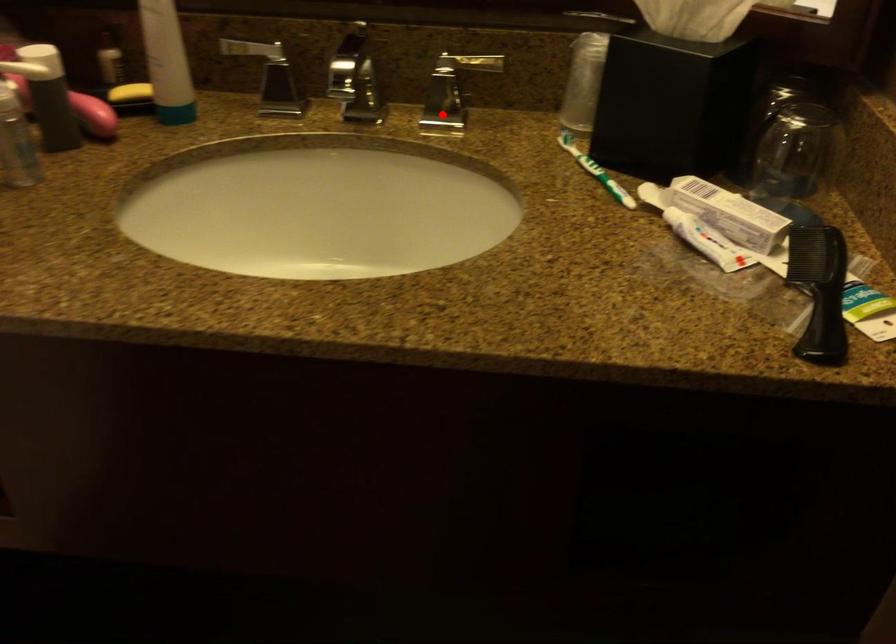
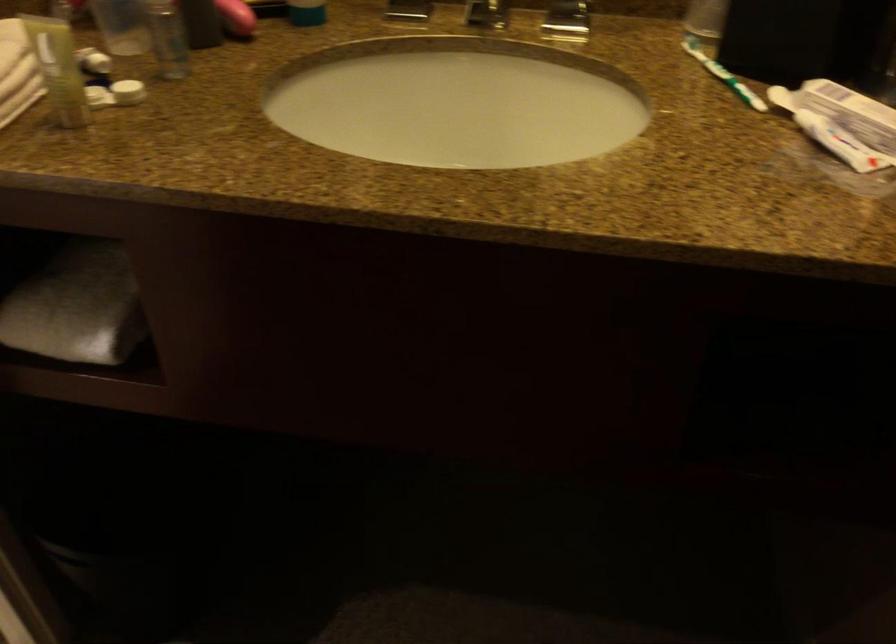
The point at the highlighted location is marked in the first image. Where is the corresponding point in the second image?

(566, 21)